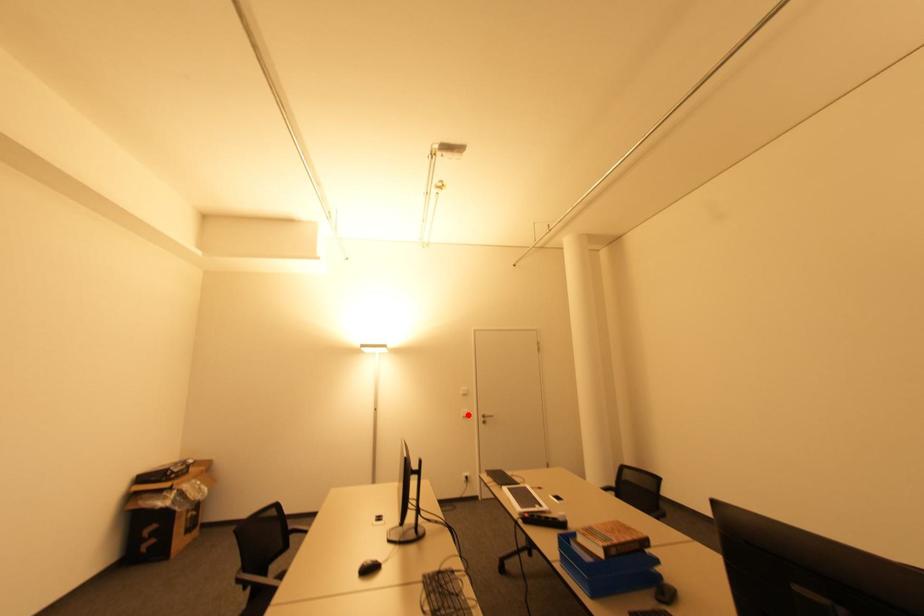
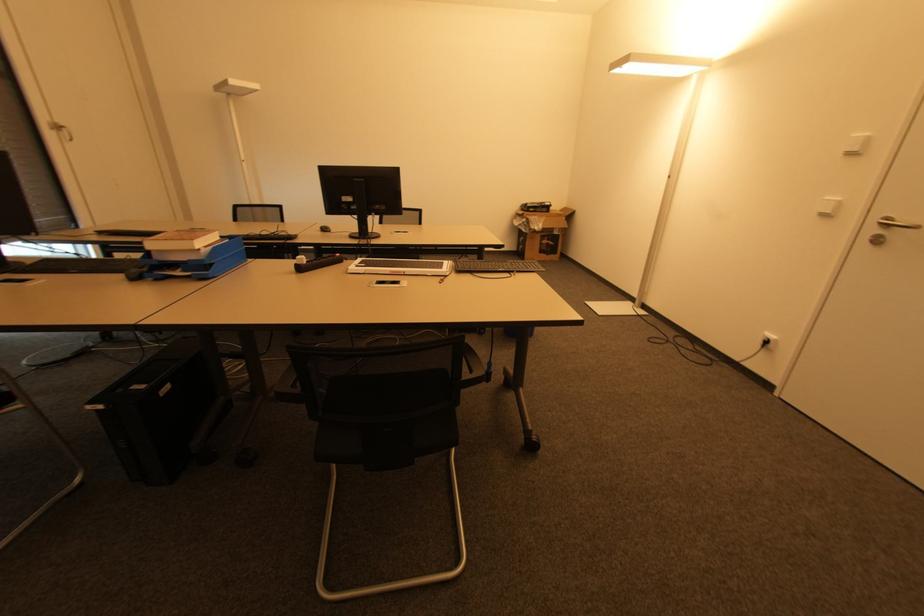
Question: I am providing you with two images of the same scene from different viewpoints. A red point is shown in image1. For the corresponding object point in image2, is it positioned nearer or farther from the camera?

Choices:
 (A) Nearer
 (B) Farther

Answer: (A)